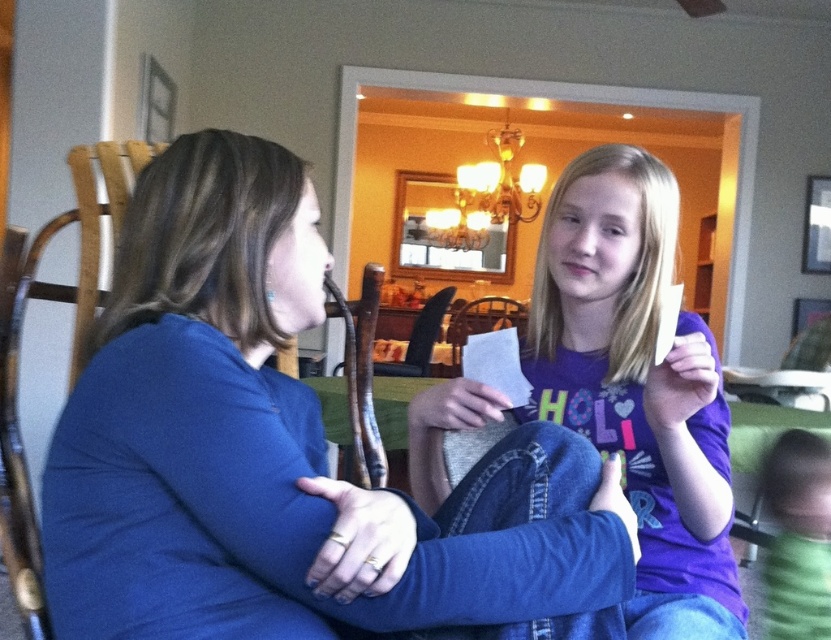
Question: In this image, where is blue fabric shirt at center located relative to purple cotton shirt at center?

Choices:
 (A) left
 (B) right

Answer: (A)

Question: Does blue fabric shirt at center appear under purple cotton shirt at center?

Choices:
 (A) yes
 (B) no

Answer: (A)

Question: In this image, where is blue fabric shirt at center located relative to purple cotton shirt at center?

Choices:
 (A) right
 (B) left

Answer: (B)